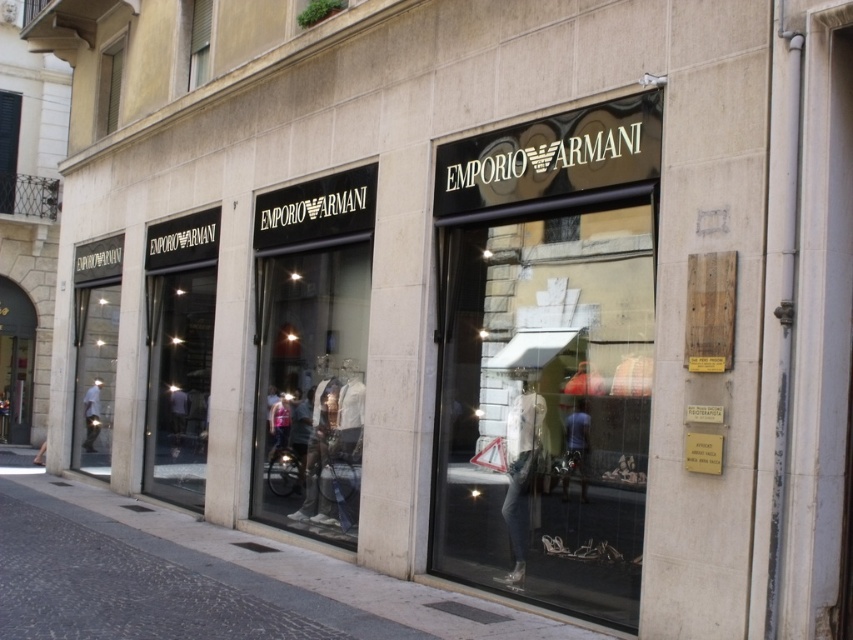
You are a customer approaching the Emporio Armani boutique. You see the transparent glass at center and the transparent glass door at center. Which one is to the right when facing the store?

The transparent glass at center is positioned on the right side of the transparent glass door at center, so when facing the store, the transparent glass at center is to the right of the transparent glass door at center.

You are a delivery person approaching the Emporio Armani boutique. You need to place a package on the ground near the entrance. Which object should you place it next to, the gray concrete pavement at lower left or the transparent glass door at center?

The gray concrete pavement at lower left is in front of the transparent glass door at center, so you should place the package next to the gray concrete pavement at lower left since it is the ground area near the entrance.